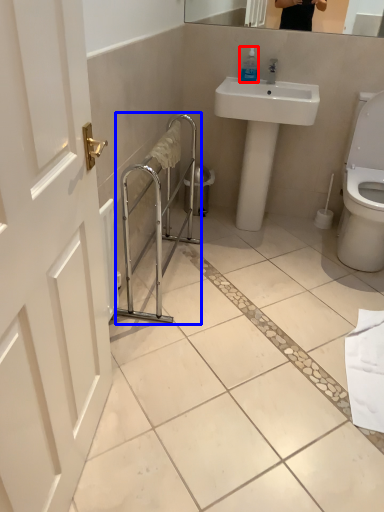
Question: Which object appears farthest to the camera in this image, soap dispenser (highlighted by a red box) or balustrade (highlighted by a blue box)?

Choices:
 (A) soap dispenser
 (B) balustrade

Answer: (A)